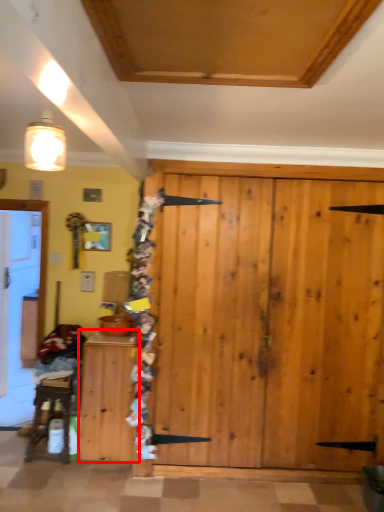
Question: From the image, what is the correct spatial relationship of cabinetry (annotated by the red box) in relation to furniture?

Choices:
 (A) right
 (B) left

Answer: (A)